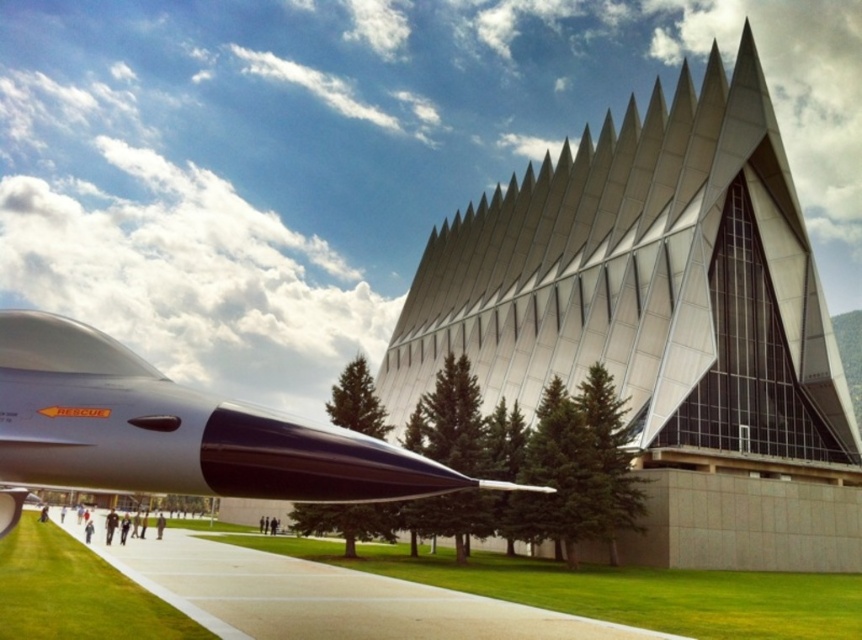
You are standing at a certain point and want to reach the entrance of the architectural structure. The entrance is located at point (636,353). If you can walk 100 feet per minute, how many minutes will it take you to reach the entrance?

The distance between your current position and the entrance at point (636,353) is 156.56 feet. At a walking speed of 100 feet per minute, it will take approximately 1.57 minutes to reach the entrance.

Based on the photo, you are an architect visiting the site and need to determine if the metallic silver building at center can be placed in a space that is narrower than the glossy metallic missile at lower left. Based on the scene, what is your conclusion?

The metallic silver building at center is wider than the glossy metallic missile at lower left, so it cannot be placed in a space narrower than the missile.